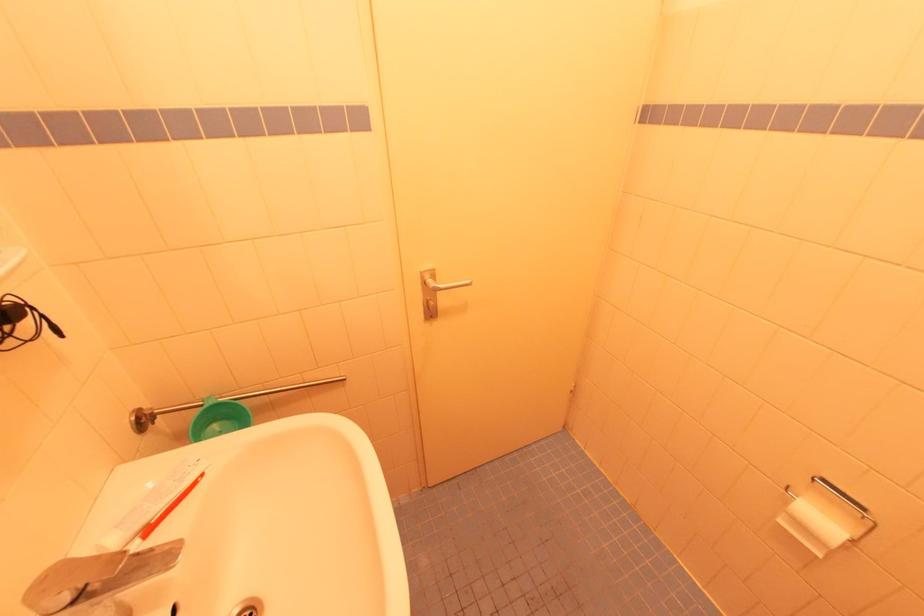
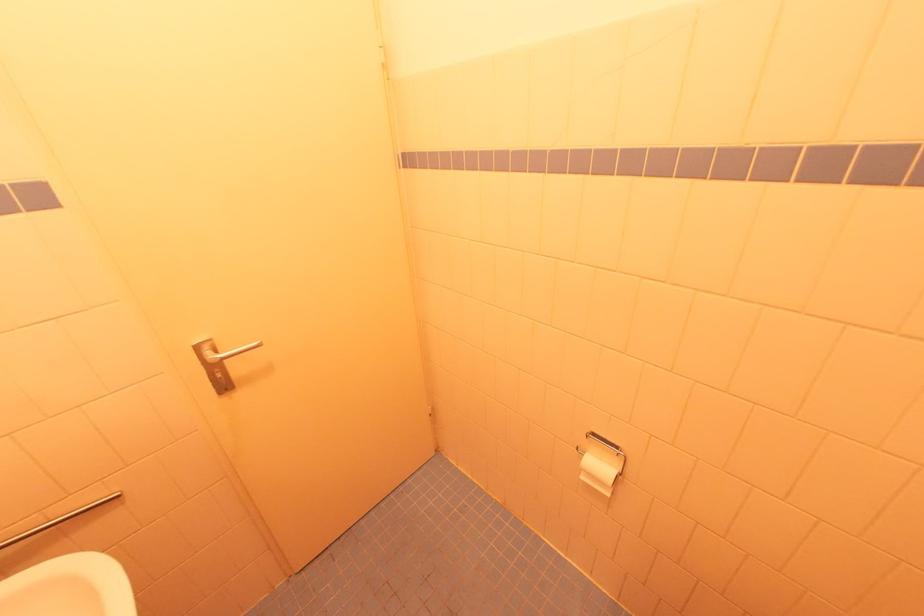
Question: I am providing you with two images of the same scene from different viewpoints. Please identify which objects are invisible in image2.

Choices:
 (A) metal towel rack
 (B) toilet paper roll
 (C) metal door handle
 (D) none of these

Answer: (D)